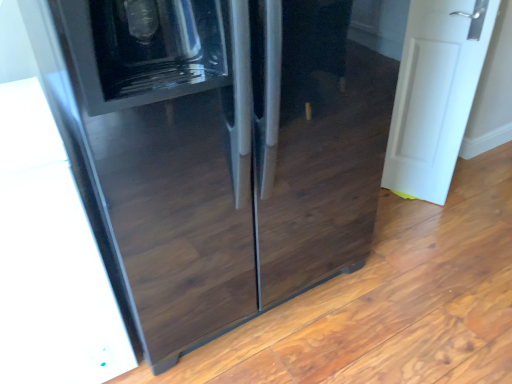
Identify the location of free region on the left part of white matte door at right. The image size is (512, 384). (392, 206).